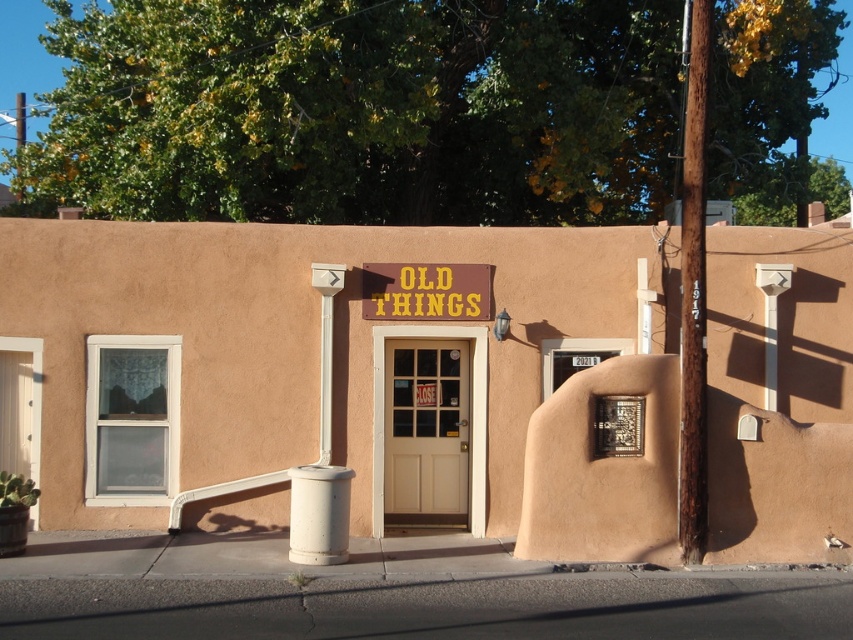
You are a delivery person trying to enter the building. The white wood door at center is the entrance. Is the brown wooden sign at center above or below the door?

The white wood door at center is positioned under the brown wooden sign at center, so the brown wooden sign at center is above the door.

You are standing in front of the matte beige building at center and the brown wooden sign at center. Which one appears taller?

The brown wooden sign at center appears taller because the matte beige building at center has a lesser height compared to it.

You are standing in front of the matte beige building at center and want to enter the white wood door at center. Can you walk directly to the door without going around the building?

The matte beige building at center is in front of the white wood door at center, so you cannot walk directly to the door without going around the building.